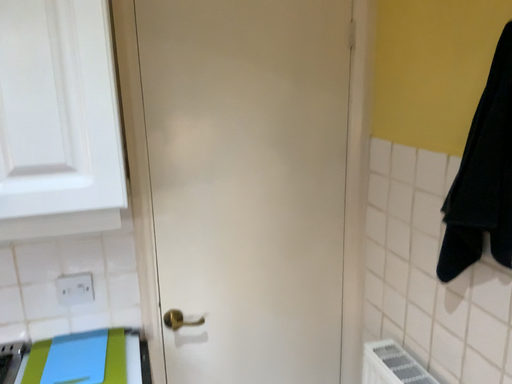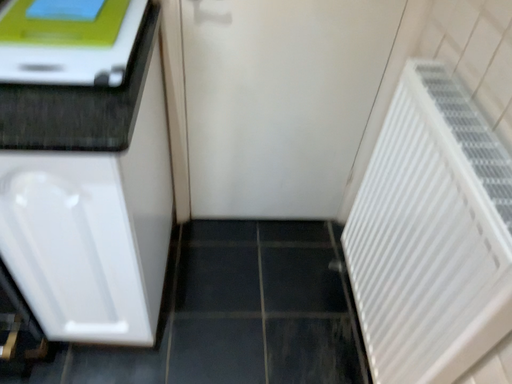
Question: Which way did the camera rotate in the video?

Choices:
 (A) rotated downward
 (B) rotated upward

Answer: (A)